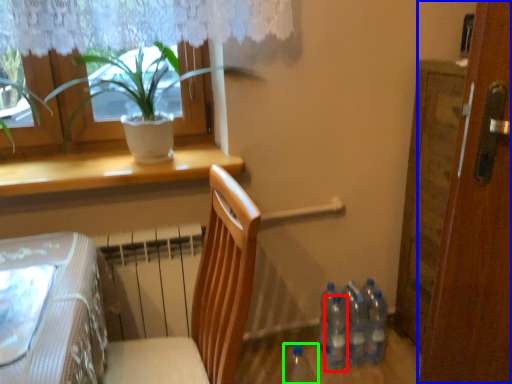
Question: Considering the real-world distances, which object is farthest from bottle (highlighted by a red box)? door (highlighted by a blue box) or bottle (highlighted by a green box)?

Choices:
 (A) door
 (B) bottle

Answer: (A)